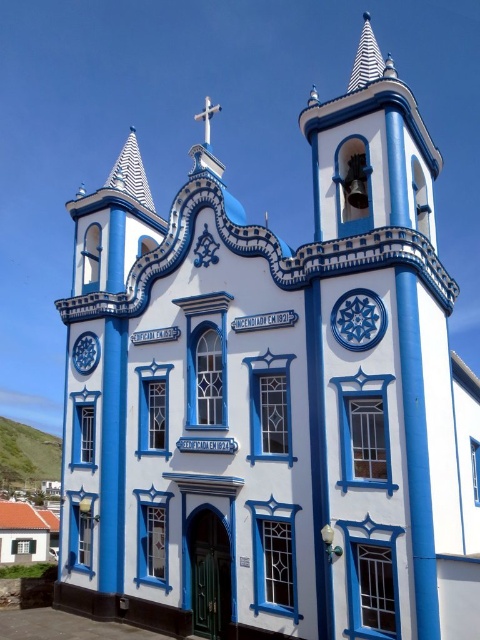
Is blue glossy clock at center in front of white striped spire at upper left?

Yes, it is in front of white striped spire at upper left.

Which is in front, point (342, 308) or point (108, 173)?

Point (342, 308) is in front.

Who is more distant from viewer, (336, 324) or (145, 177)?

Positioned behind is point (145, 177).

Image resolution: width=480 pixels, height=640 pixels. I want to click on blue glossy clock at center, so click(359, 320).

Is white striped spire at upper center wider than matte blue clock at upper left?

Yes, white striped spire at upper center is wider than matte blue clock at upper left.

Is white striped spire at upper center closer to camera compared to matte blue clock at upper left?

That is True.

The width and height of the screenshot is (480, 640). Describe the element at coordinates (365, 58) in the screenshot. I see `white striped spire at upper center` at that location.

The height and width of the screenshot is (640, 480). I want to click on white striped spire at upper center, so click(365, 58).

Where is `blue glossy clock at center`? Image resolution: width=480 pixels, height=640 pixels. blue glossy clock at center is located at coordinates (359, 320).

At what (x,y) coordinates should I click in order to perform the action: click on blue glossy clock at center. Please return your answer as a coordinate pair (x, y). Looking at the image, I should click on (359, 320).

Where is `blue glossy clock at center`? Image resolution: width=480 pixels, height=640 pixels. blue glossy clock at center is located at coordinates (359, 320).